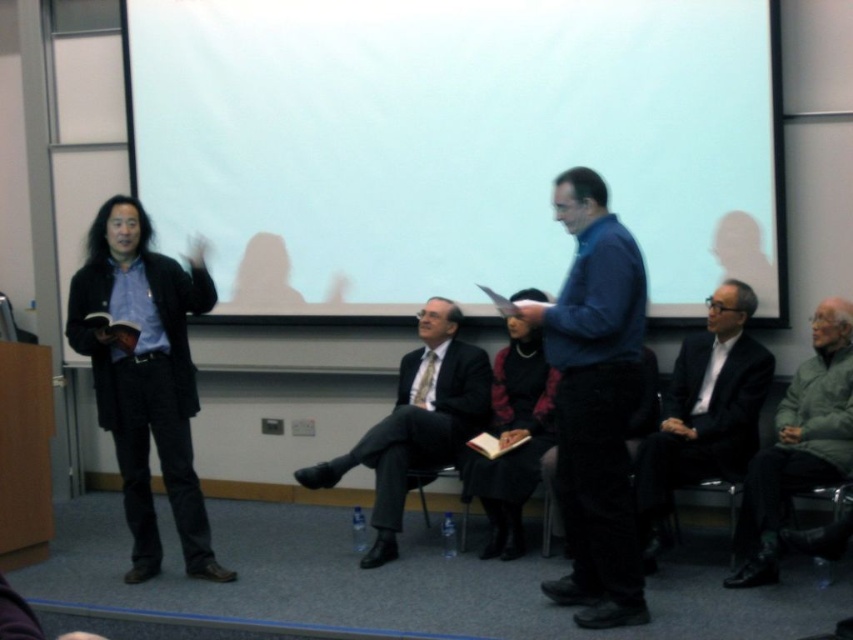
Is matte black suit at center below green wool sweater at right?

No, matte black suit at center is not below green wool sweater at right.

Between matte black suit at center and green wool sweater at right, which one has less height?

green wool sweater at right

Which is in front, point (482, 417) or point (809, 465)?

Point (809, 465) is more forward.

At what (x,y) coordinates should I click in order to perform the action: click on matte black suit at center. Please return your answer as a coordinate pair (x, y). Looking at the image, I should click on (416, 422).

Which is behind, point (143, 216) or point (514, 456)?

The point (514, 456) is behind.

Which is more to the right, matte black jacket at left or velvet black dress at center?

From the viewer's perspective, velvet black dress at center appears more on the right side.

What do you see at coordinates (146, 378) in the screenshot?
I see `matte black jacket at left` at bounding box center [146, 378].

Identify the location of matte black jacket at left. (146, 378).

Between matte black jacket at left and matte black suit at center, which one has less height?

matte black suit at center

Is point (194, 531) positioned before point (463, 355)?

That is True.

Who is more forward, (193,506) or (397,516)?

Point (193,506)

The height and width of the screenshot is (640, 853). Identify the location of matte black jacket at left. (146, 378).